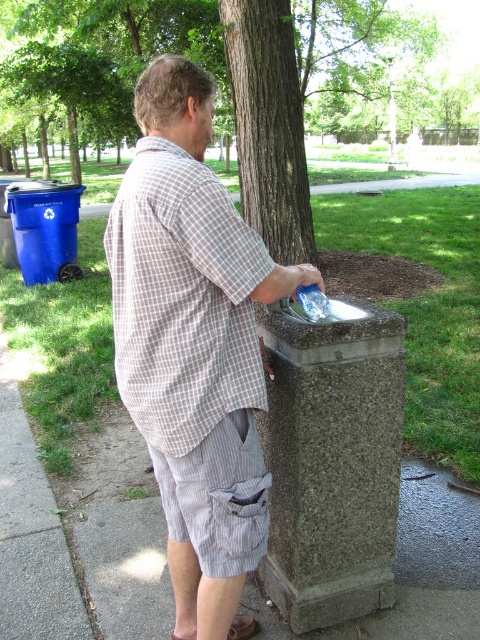
You are a park maintenance worker checking the drinking fountain. You notice a point at coordinates (312, 301). Where is this point located?

The point at coordinates (312, 301) is located on the clear plastic bottle at center.

You are a delivery robot with a package that needs to be placed between the checkered fabric shirt at upper left and the brown leather sandal at lower center. The package is 30 inches long. Can you fit it between them?

The distance between the checkered fabric shirt at upper left and the brown leather sandal at lower center is 35.72 inches, so the 30 inch package can fit between them.

You are a photographer trying to capture the man filling his water bottle at the drinking fountain. You want to ensure both the gray checkered shirt at center and the brown leather sandal at lower center are clearly visible in your photo. Given their sizes, which object should you focus on to ensure both are in frame without needing to adjust your camera zoom?

The gray checkered shirt at center is larger than the brown leather sandal at lower center, so focusing on the gray checkered shirt at center will ensure both objects are in frame without needing to adjust the camera zoom.